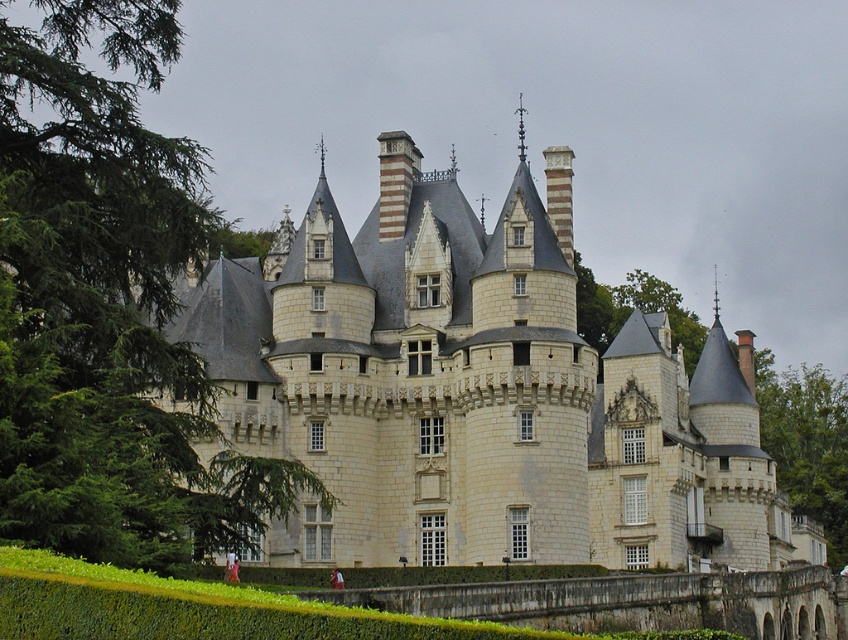
Question: Does white stone castle at center have a lesser width compared to green leafy tree at left?

Choices:
 (A) yes
 (B) no

Answer: (B)

Question: Which of the following is the closest to the observer?

Choices:
 (A) (59, 442)
 (B) (622, 516)

Answer: (A)

Question: Observing the image, what is the correct spatial positioning of white stone castle at center in reference to green leafy tree at left?

Choices:
 (A) below
 (B) above

Answer: (A)

Question: Which point is farther to the camera?

Choices:
 (A) green leafy tree at left
 (B) white stone castle at center

Answer: (B)

Question: Can you confirm if white stone castle at center is positioned above green leafy tree at left?

Choices:
 (A) yes
 (B) no

Answer: (B)

Question: Which point appears farthest from the camera in this image?

Choices:
 (A) (737, 499)
 (B) (155, 257)

Answer: (A)